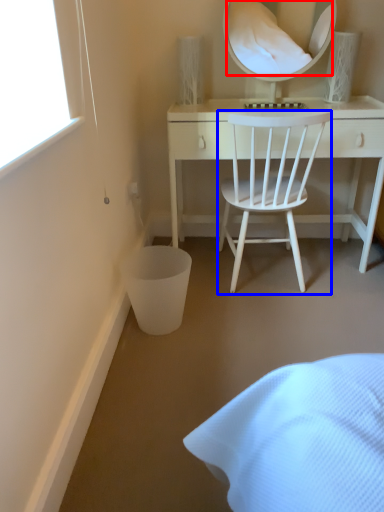
Question: Which object is further to the camera taking this photo, mirror (highlighted by a red box) or chair (highlighted by a blue box)?

Choices:
 (A) mirror
 (B) chair

Answer: (A)